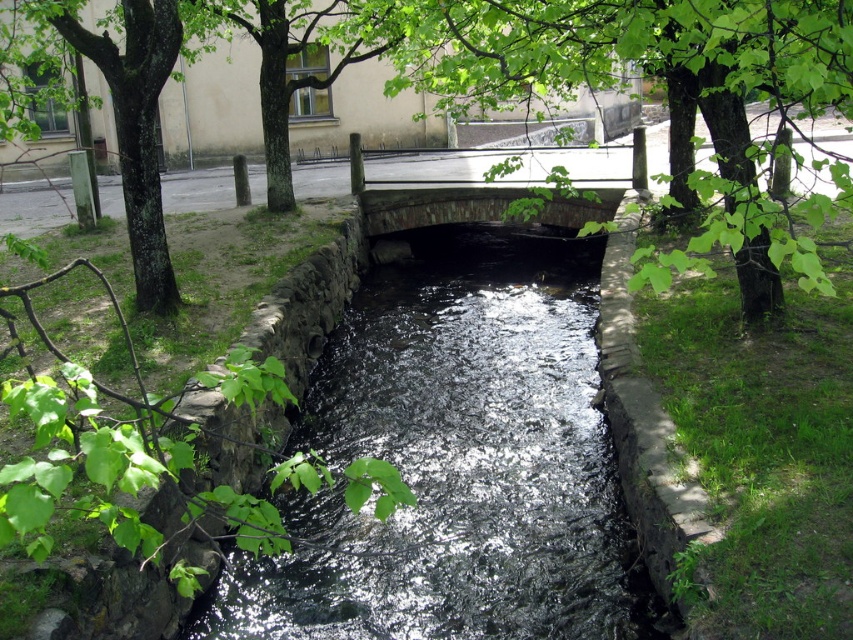
From the picture: Is shiny dark water at center smaller than green leafy tree at center?

Yes, shiny dark water at center is smaller than green leafy tree at center.

At what (x,y) coordinates should I click in order to perform the action: click on shiny dark water at center. Please return your answer as a coordinate pair (x, y). The image size is (853, 640). Looking at the image, I should click on (456, 460).

Is the position of shiny dark water at center less distant than that of stone bridge at center?

Yes.

Between shiny dark water at center and stone bridge at center, which one is positioned lower?

Positioned lower is shiny dark water at center.

This screenshot has height=640, width=853. What do you see at coordinates (456, 460) in the screenshot?
I see `shiny dark water at center` at bounding box center [456, 460].

What are the coordinates of `shiny dark water at center` in the screenshot? It's located at (456, 460).

Between point (473, 13) and point (596, 208), which one is positioned behind?

The point (596, 208) is behind.

Can you confirm if green leafy tree at center is positioned to the left of stone bridge at center?

Incorrect, green leafy tree at center is not on the left side of stone bridge at center.

The height and width of the screenshot is (640, 853). Describe the element at coordinates (647, 72) in the screenshot. I see `green leafy tree at center` at that location.

Where is `green leafy tree at center`? This screenshot has width=853, height=640. green leafy tree at center is located at coordinates (647, 72).